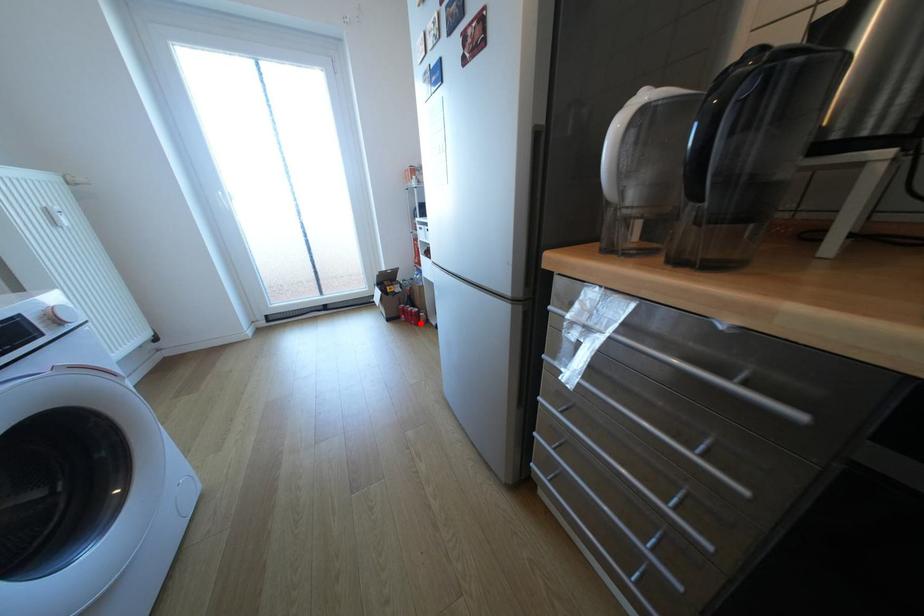
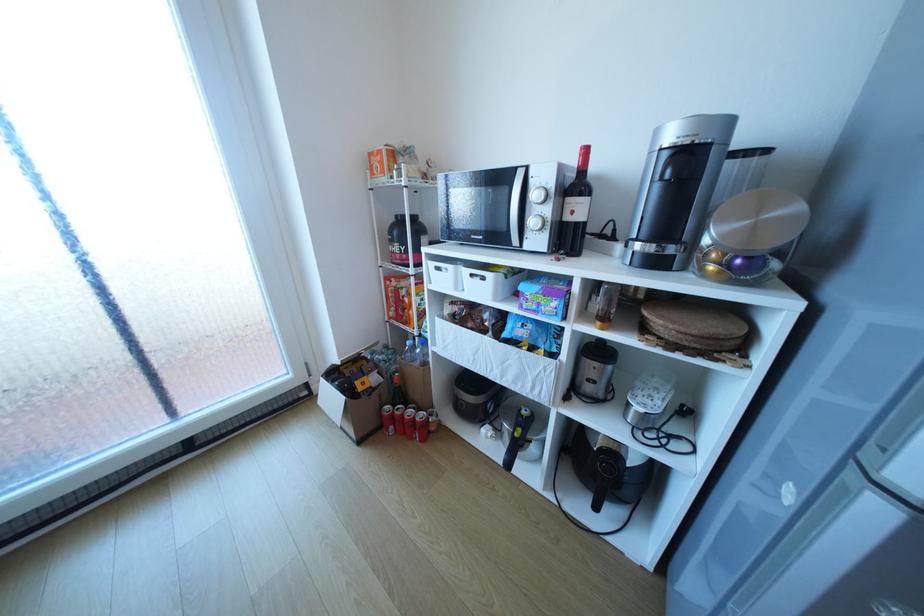
Locate, in the second image, the point that corresponds to the highlighted location in the first image.

(420, 438)